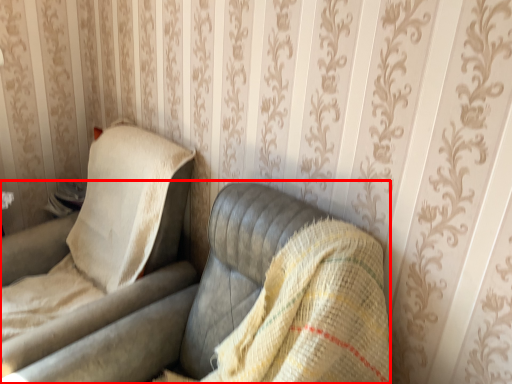
Question: From the image's perspective, where is studio couch (annotated by the red box) located in relation to chair in the image?

Choices:
 (A) below
 (B) above

Answer: (A)